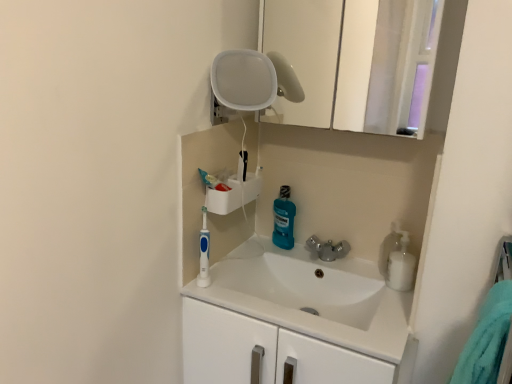
Where is `free location to the right of blue plastic toothbrush at center-left`? free location to the right of blue plastic toothbrush at center-left is located at coordinates (237, 292).